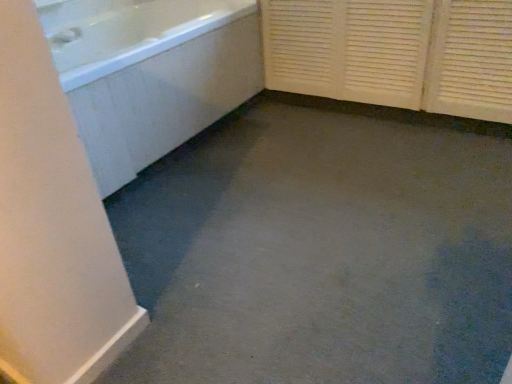
Question: Is white glossy faucet at upper left aimed at white glossy bathtub at upper left?

Choices:
 (A) yes
 (B) no

Answer: (A)

Question: Is white glossy faucet at upper left wider than white glossy bathtub at upper left?

Choices:
 (A) no
 (B) yes

Answer: (A)

Question: Is white glossy faucet at upper left surrounding white glossy bathtub at upper left?

Choices:
 (A) no
 (B) yes

Answer: (A)

Question: Is white glossy faucet at upper left shorter than white glossy bathtub at upper left?

Choices:
 (A) no
 (B) yes

Answer: (B)

Question: From a real-world perspective, is white glossy faucet at upper left over white glossy bathtub at upper left?

Choices:
 (A) no
 (B) yes

Answer: (B)

Question: Considering the positions of point (49, 39) and point (205, 117), is point (49, 39) closer or farther from the camera than point (205, 117)?

Choices:
 (A) closer
 (B) farther

Answer: (A)

Question: Looking at the image, does white glossy faucet at upper left seem bigger or smaller compared to white glossy bathtub at upper left?

Choices:
 (A) small
 (B) big

Answer: (A)

Question: Is white glossy faucet at upper left taller or shorter than white glossy bathtub at upper left?

Choices:
 (A) short
 (B) tall

Answer: (A)

Question: Considering their positions, is white glossy faucet at upper left located in front of or behind white glossy bathtub at upper left?

Choices:
 (A) front
 (B) behind

Answer: (B)

Question: Visually, is white glossy bathtub at upper left positioned to the left or to the right of white glossy faucet at upper left?

Choices:
 (A) right
 (B) left

Answer: (A)

Question: In terms of size, does white glossy bathtub at upper left appear bigger or smaller than white glossy faucet at upper left?

Choices:
 (A) small
 (B) big

Answer: (B)

Question: Is white glossy bathtub at upper left in front of or behind white glossy faucet at upper left in the image?

Choices:
 (A) front
 (B) behind

Answer: (A)

Question: From the image's perspective, relative to white glossy faucet at upper left, is white glossy bathtub at upper left above or below?

Choices:
 (A) below
 (B) above

Answer: (A)

Question: Does point (69, 43) appear closer or farther from the camera than point (477, 56)?

Choices:
 (A) closer
 (B) farther

Answer: (B)

Question: Relative to white textured screen door at right, is white glossy faucet at upper left in front or behind?

Choices:
 (A) behind
 (B) front

Answer: (A)